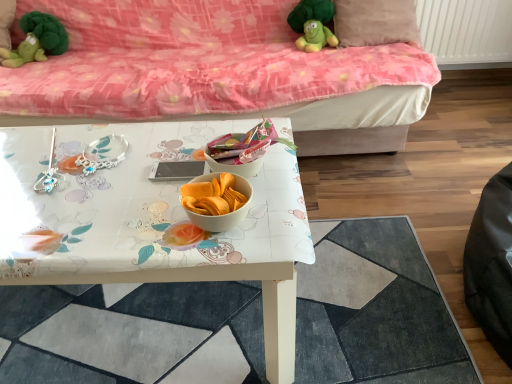
Locate an element on the screen. The width and height of the screenshot is (512, 384). free point above white glossy table at center (from a real-world perspective) is located at coordinates (260, 307).